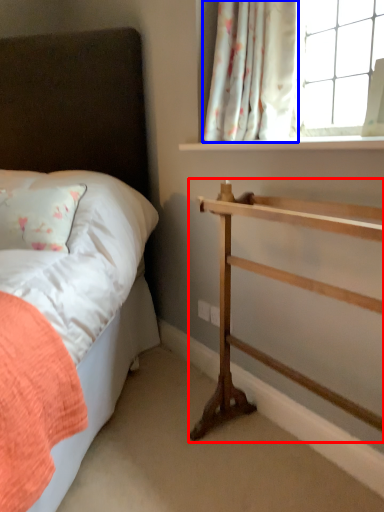
Question: Which object is closer to the camera taking this photo, shelf (highlighted by a red box) or curtain (highlighted by a blue box)?

Choices:
 (A) shelf
 (B) curtain

Answer: (A)